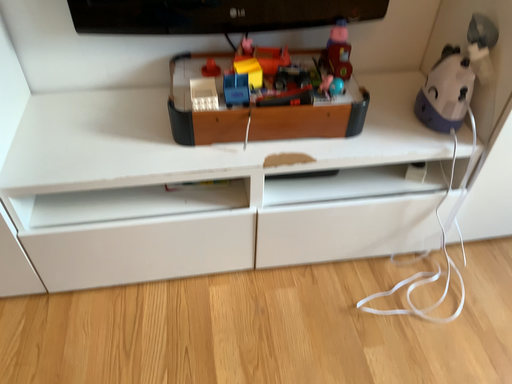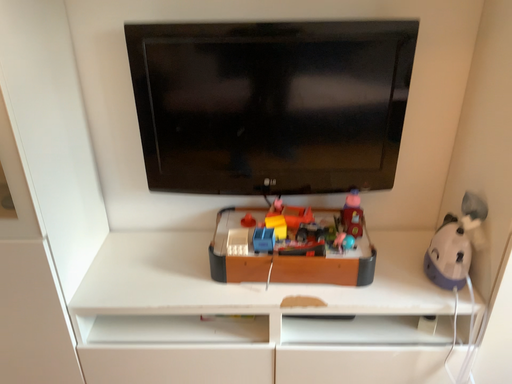
Question: Which way did the camera rotate in the video?

Choices:
 (A) rotated downward
 (B) rotated upward

Answer: (B)